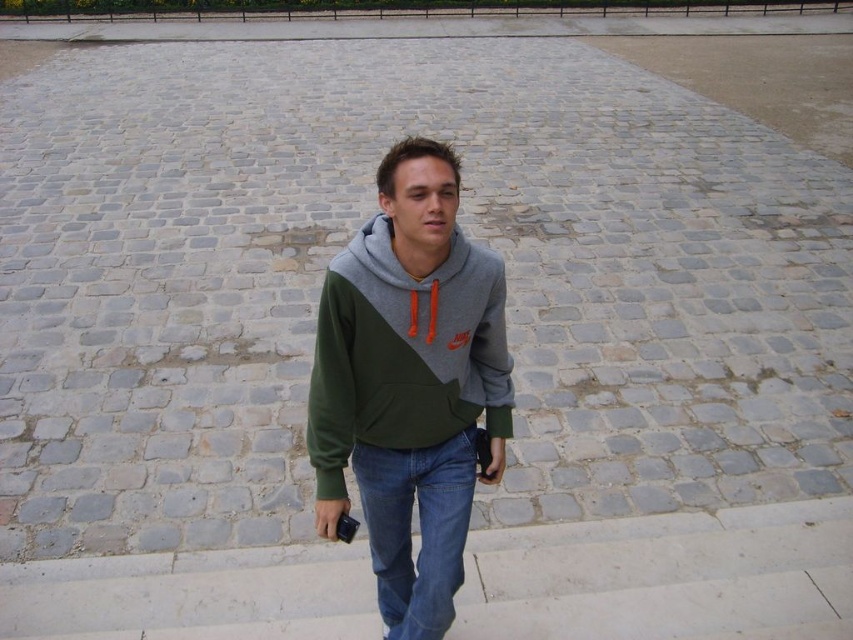
Question: Can you confirm if green fleece hoodie at center is thinner than denim at center?

Choices:
 (A) no
 (B) yes

Answer: (A)

Question: Does green fleece hoodie at center appear on the left side of denim at center?

Choices:
 (A) yes
 (B) no

Answer: (B)

Question: Is green fleece hoodie at center positioned before denim at center?

Choices:
 (A) yes
 (B) no

Answer: (A)

Question: Among these objects, which one is farthest from the camera?

Choices:
 (A) green fleece hoodie at center
 (B) denim at center

Answer: (B)

Question: Which point is closer to the camera taking this photo?

Choices:
 (A) (424, 186)
 (B) (447, 504)

Answer: (A)